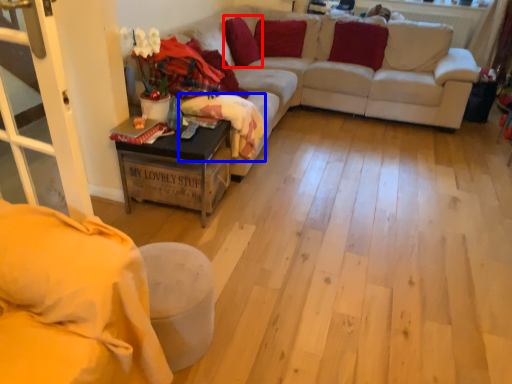
Question: Which point is further to the camera, pillow (highlighted by a red box) or blanket (highlighted by a blue box)?

Choices:
 (A) pillow
 (B) blanket

Answer: (A)